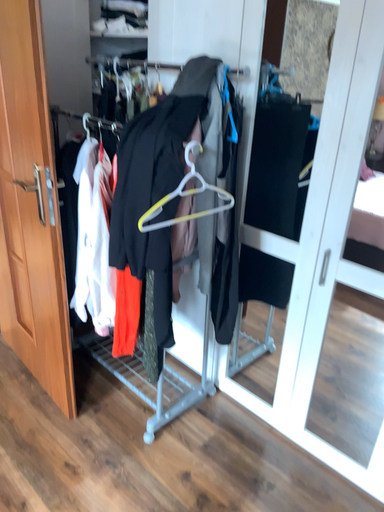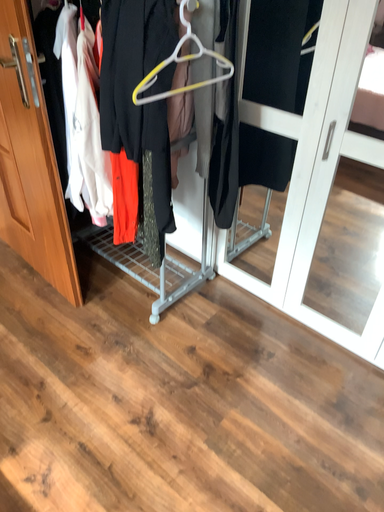
Question: How did the camera likely rotate when shooting the video?

Choices:
 (A) rotated upward
 (B) rotated downward

Answer: (B)